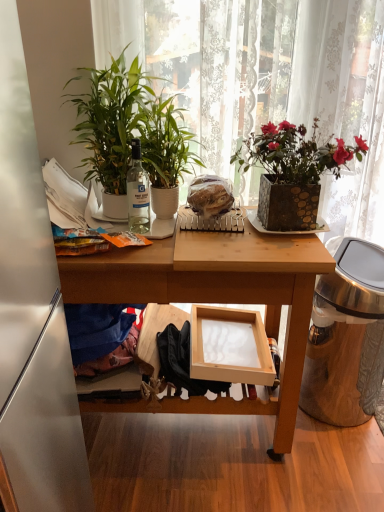
This screenshot has height=512, width=384. I want to click on vacant area that is in front of shiny metallic trash can at right, so click(x=337, y=467).